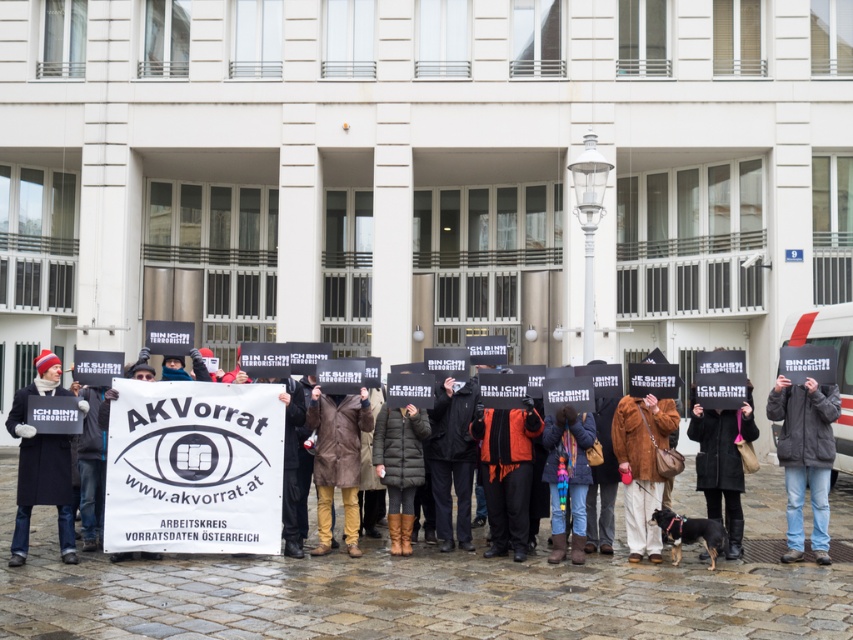
You are standing in front of the modern building and see two points marked on the ground. The first point is at coordinates point [791,396] and the second is at point [664,420]. Which point is closer to the building?

Point [791,396] is behind point [664,420], so the point closer to the building is point [664,420].

What is the exact coordinate of the black matte coat at left?

The black matte coat at left is located at point (41, 465).